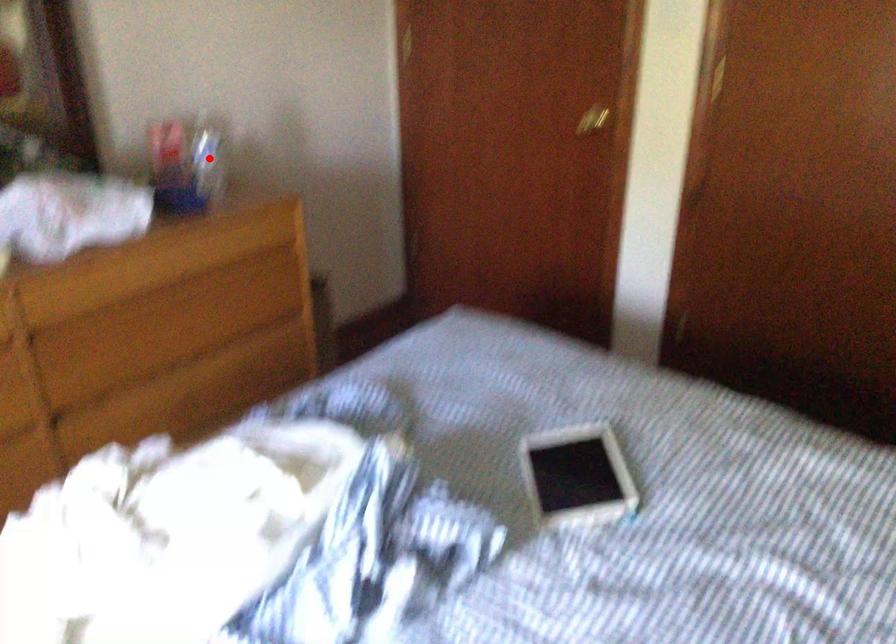
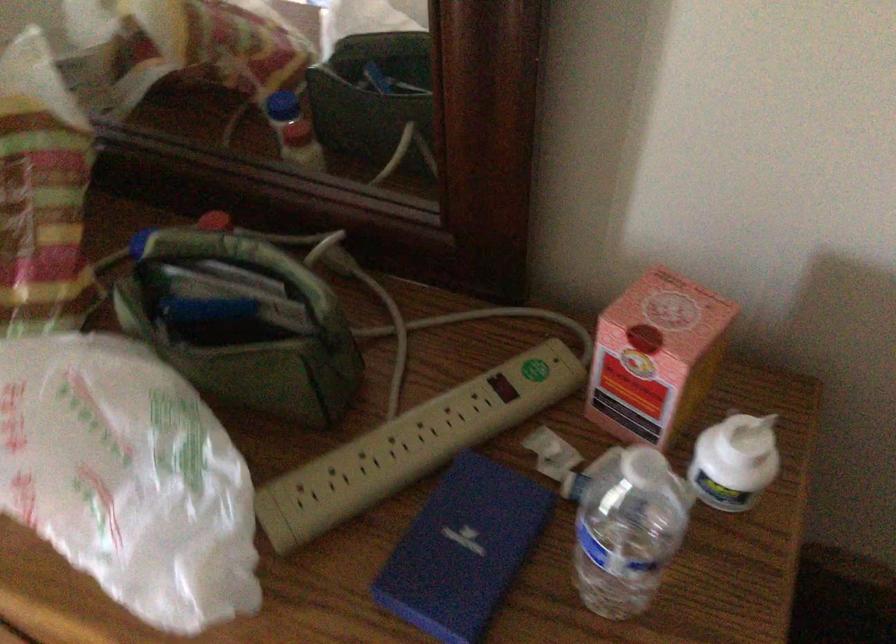
In the second image, find the point that corresponds to the highlighted location in the first image.

(735, 462)